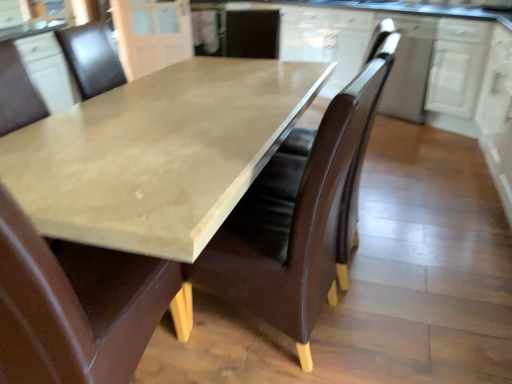
Locate an element on the screen. The image size is (512, 384). free point to the left of white glossy cabinet at upper right, which is counted as the fourth cabinetry, starting from the left is located at coordinates [406, 137].